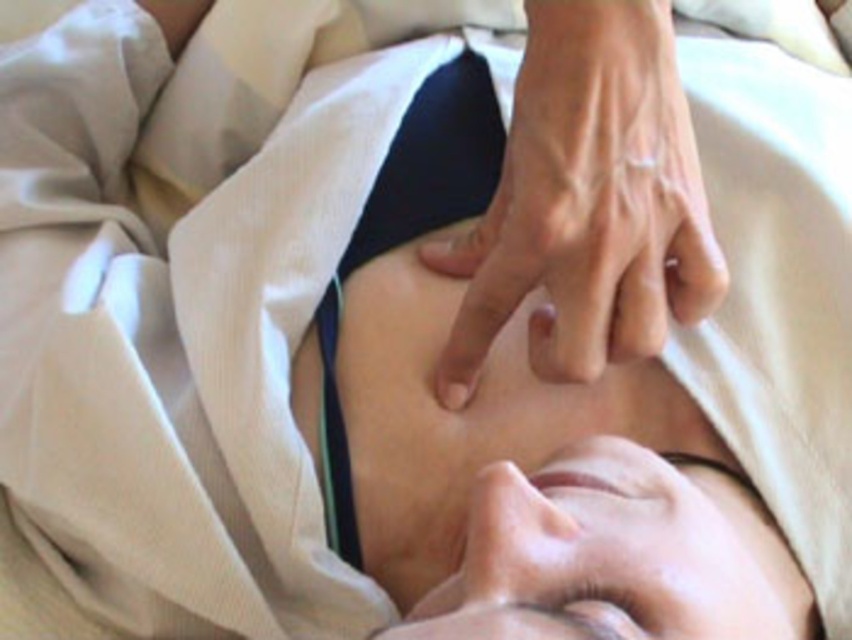
Question: Does smooth skin hand at center have a smaller size compared to smooth skin head at center?

Choices:
 (A) yes
 (B) no

Answer: (B)

Question: Considering the real-world distances, which object is closest to the smooth skin hand at center?

Choices:
 (A) smooth skin head at center
 (B) brown matte eye at upper center

Answer: (A)

Question: Is smooth skin head at center above brown matte eye at upper center?

Choices:
 (A) yes
 (B) no

Answer: (A)

Question: Does smooth skin hand at center come in front of smooth skin head at center?

Choices:
 (A) no
 (B) yes

Answer: (A)

Question: Which point is closer to the camera taking this photo?

Choices:
 (A) (602, 595)
 (B) (533, 115)
 (C) (778, 595)

Answer: (A)

Question: Which point appears closest to the camera in this image?

Choices:
 (A) (607, 545)
 (B) (565, 612)
 (C) (666, 29)

Answer: (B)